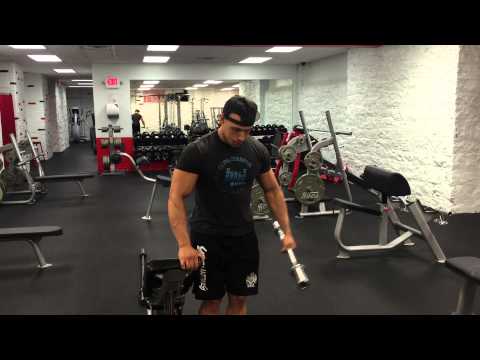
The width and height of the screenshot is (480, 360). I want to click on lights, so click(x=213, y=78), click(x=201, y=83), click(x=194, y=87), click(x=150, y=79), click(x=146, y=82), click(x=142, y=89).